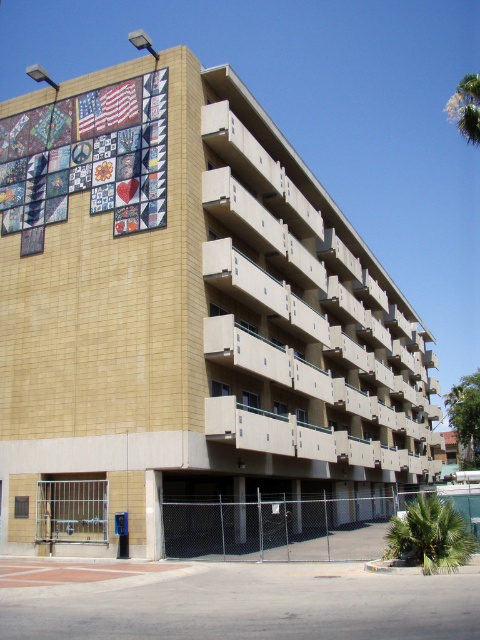
Is green leafy palm tree at lower right shorter than green leafy palm tree at upper right?

Correct, green leafy palm tree at lower right is not as tall as green leafy palm tree at upper right.

Between point (450, 564) and point (472, 84), which one is positioned behind?

The point (472, 84) is more distant.

Is point (404, 532) closer to viewer compared to point (448, 100)?

Yes, it is.

The image size is (480, 640). In order to click on green leafy palm tree at lower right in this screenshot , I will do `click(431, 536)`.